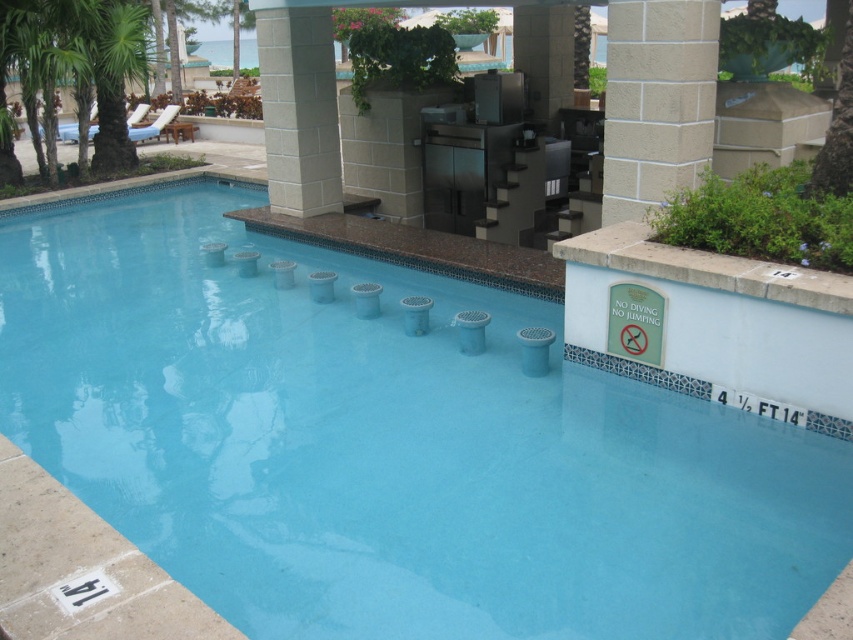
Question: Which point is farther to the camera?

Choices:
 (A) (619, 58)
 (B) (334, 157)

Answer: (B)

Question: Considering the real-world distances, which object is farthest from the white textured pillar at upper center?

Choices:
 (A) beige stone pillar at center
 (B) clear blue water at center

Answer: (A)

Question: Is clear blue water at center below white textured pillar at upper center?

Choices:
 (A) no
 (B) yes

Answer: (B)

Question: Can you confirm if clear blue water at center is positioned to the right of beige stone pillar at center?

Choices:
 (A) yes
 (B) no

Answer: (A)

Question: Is clear blue water at center smaller than white textured pillar at upper center?

Choices:
 (A) no
 (B) yes

Answer: (B)

Question: Which point appears farthest from the camera in this image?

Choices:
 (A) (444, 428)
 (B) (608, 68)
 (C) (289, 67)

Answer: (C)